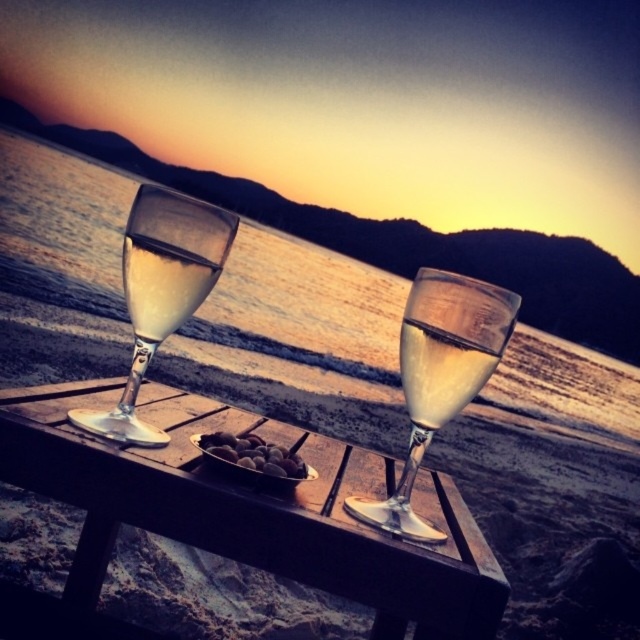
Can you confirm if clear glass wine glass at left is positioned above brown matte nuts at center?

Indeed, clear glass wine glass at left is positioned over brown matte nuts at center.

Which is more to the left, clear glass wine glass at left or brown matte nuts at center?

clear glass wine glass at left is more to the left.

Between point (81, 419) and point (243, 458), which one is positioned in front?

Point (81, 419) is more forward.

You are a GUI agent. You are given a task and a screenshot of the screen. Output one action in this format:
    pyautogui.click(x=<x>, y=<y>)
    Task: Click on the clear glass wine glass at left
    
    Given the screenshot: What is the action you would take?
    pyautogui.click(x=161, y=291)

In the scene shown: Is the position of clear glass wine glass at center more distant than that of clear glass wine at center?

No, it is not.

Which of these two, clear glass wine glass at center or clear glass wine at center, stands shorter?

With less height is clear glass wine at center.

This screenshot has width=640, height=640. What do you see at coordinates (440, 376) in the screenshot? I see `clear glass wine glass at center` at bounding box center [440, 376].

You are a GUI agent. You are given a task and a screenshot of the screen. Output one action in this format:
    pyautogui.click(x=<x>, y=<y>)
    Task: Click on the clear glass wine glass at center
    
    Given the screenshot: What is the action you would take?
    pyautogui.click(x=440, y=376)

Describe the element at coordinates (304, 305) in the screenshot. This screenshot has width=640, height=640. I see `transparent glass water at center` at that location.

Is transparent glass water at center taller than clear glass wine at center?

Yes, transparent glass water at center is taller than clear glass wine at center.

What do you see at coordinates (304, 305) in the screenshot? I see `transparent glass water at center` at bounding box center [304, 305].

Find the location of `transparent glass water at center`. transparent glass water at center is located at coordinates (304, 305).